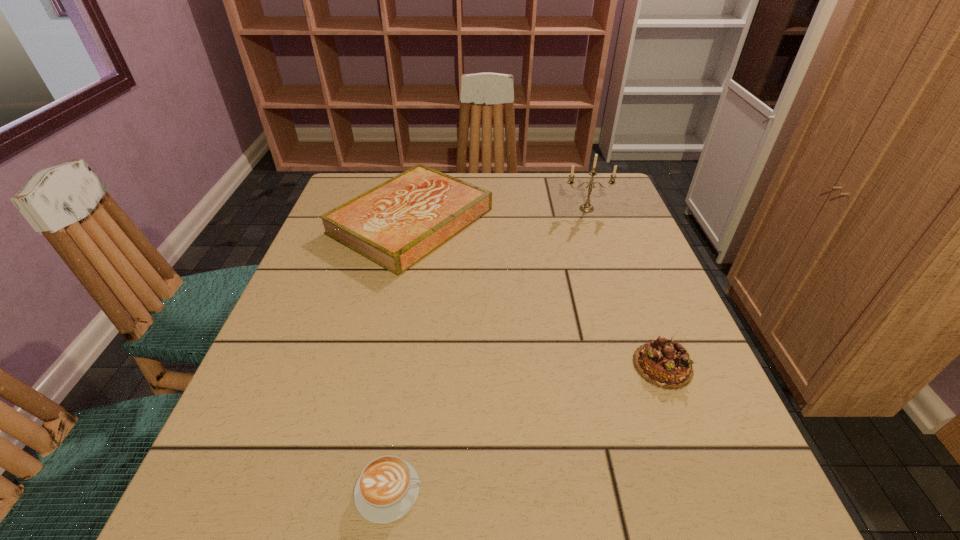
The image size is (960, 540). Find the location of `hardback book at the far edge`. hardback book at the far edge is located at coordinates (396, 224).

This screenshot has height=540, width=960. In order to click on object present at the near edge in this screenshot , I will do `click(387, 488)`.

Locate an element on the screen. The width and height of the screenshot is (960, 540). object that is at the left edge is located at coordinates (396, 224).

The width and height of the screenshot is (960, 540). I want to click on candle that is at the right edge, so click(x=587, y=207).

Where is `chocolate cake that is at the right edge`? Image resolution: width=960 pixels, height=540 pixels. chocolate cake that is at the right edge is located at coordinates (663, 363).

Find the location of a particular element. object present at the far left corner is located at coordinates pyautogui.click(x=396, y=224).

You are a GUI agent. You are given a task and a screenshot of the screen. Output one action in this format:
    pyautogui.click(x=<x>, y=<y>)
    Task: Click on the object present at the far right corner
    The width and height of the screenshot is (960, 540).
    Given the screenshot: What is the action you would take?
    pyautogui.click(x=587, y=207)

Where is `free space at the far edge of the desktop`? The image size is (960, 540). free space at the far edge of the desktop is located at coordinates (536, 183).

In the image, there is a desktop. Where is `free region at the near edge`? free region at the near edge is located at coordinates (551, 490).

You are a GUI agent. You are given a task and a screenshot of the screen. Output one action in this format:
    pyautogui.click(x=<x>, y=<y>)
    Task: Click on the free space at the left edge of the desktop
    
    Given the screenshot: What is the action you would take?
    pyautogui.click(x=336, y=352)